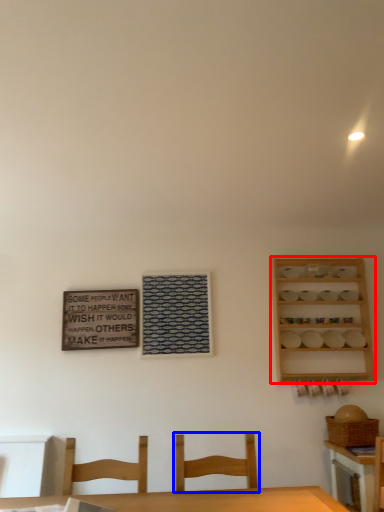
Question: Which of the following is the closest to the observer, shelf (highlighted by a red box) or chair (highlighted by a blue box)?

Choices:
 (A) shelf
 (B) chair

Answer: (B)